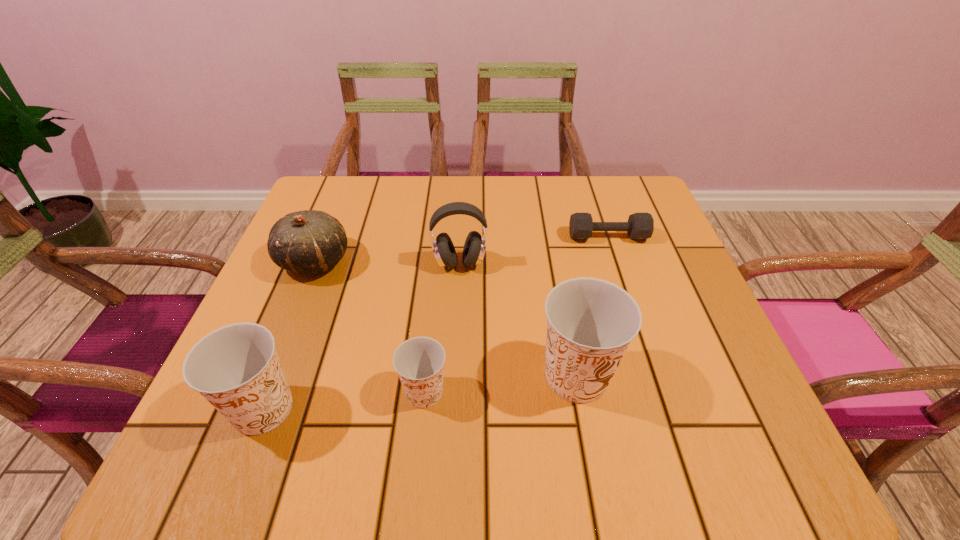
Locate an element on the screen. The height and width of the screenshot is (540, 960). vacant area situated on the front of the gourd is located at coordinates (298, 303).

The width and height of the screenshot is (960, 540). What are the coordinates of `free region located 0.080m on the front of the shortest object` in the screenshot? It's located at (618, 267).

Find the location of a particular element. The height and width of the screenshot is (540, 960). free space located 0.110m on the ear cups of the headset is located at coordinates (458, 313).

Identify the location of object at the far edge. (640, 226).

You are a GUI agent. You are given a task and a screenshot of the screen. Output one action in this format:
    pyautogui.click(x=<x>, y=<y>)
    Task: Click on the Dixie cup that is at the left edge
    The image size is (960, 540).
    Given the screenshot: What is the action you would take?
    pyautogui.click(x=236, y=368)

Where is `gourd positioned at the left edge`? This screenshot has width=960, height=540. gourd positioned at the left edge is located at coordinates (309, 242).

Identify the location of object that is at the right edge. Image resolution: width=960 pixels, height=540 pixels. (640, 226).

Where is `object that is at the near left corner`? This screenshot has width=960, height=540. object that is at the near left corner is located at coordinates (236, 368).

The height and width of the screenshot is (540, 960). In order to click on object located in the far right corner section of the desktop in this screenshot , I will do point(640,226).

Image resolution: width=960 pixels, height=540 pixels. In order to click on free space at the far edge in this screenshot , I will do `click(539, 218)`.